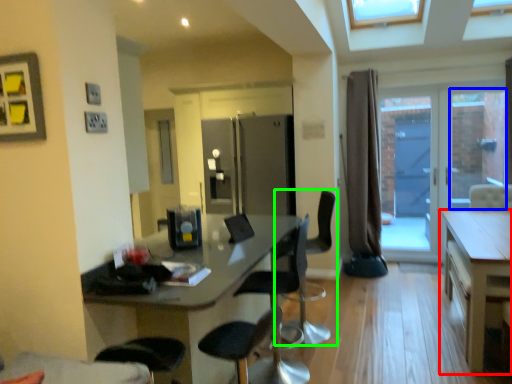
Question: Which object is the farthest from table (highlighted by a red box)? Choose among these: window (highlighted by a blue box) or chair (highlighted by a green box).

Choices:
 (A) window
 (B) chair

Answer: (A)